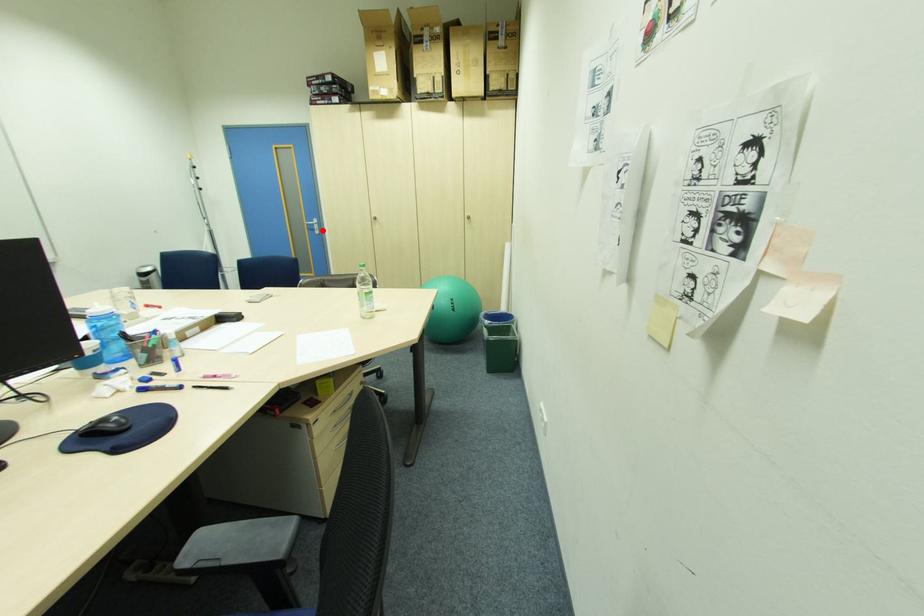
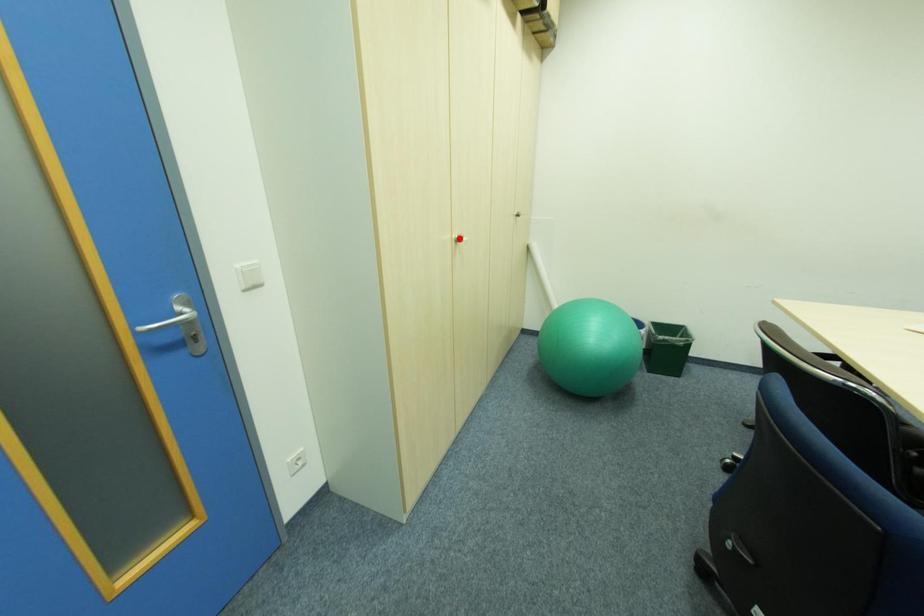
I am providing you with two images of the same scene from different viewpoints. A red point is marked on the first image and another point is marked on the second image. Is the red point in image1 aligned with the point shown in image2?

No